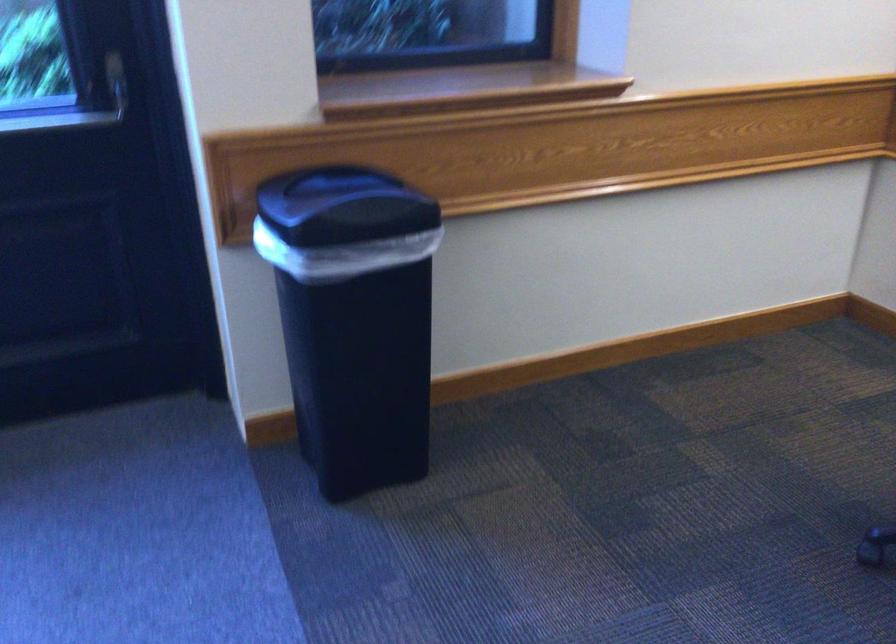
The images are taken continuously from a first-person perspective. In which direction is your viewpoint rotating?

The rotation direction of the camera is right-down.